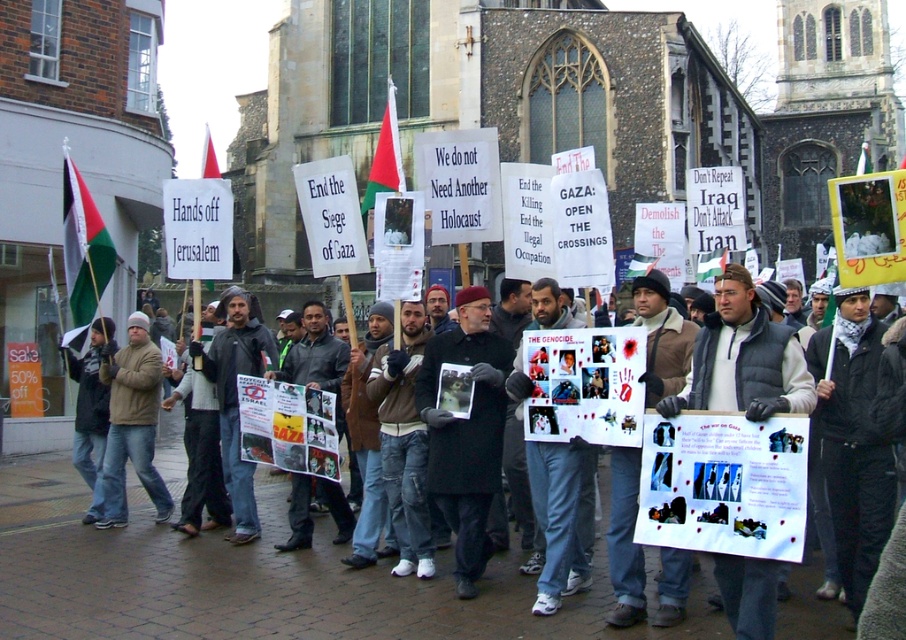
Between white paper poster at center and white fabric flag at center, which one has more height?

white fabric flag at center is taller.

Is point (747, 300) farther from camera compared to point (209, 131)?

No, (747, 300) is closer to viewer.

Between point (815, 394) and point (207, 128), which one is positioned in front?

Point (815, 394) is more forward.

Identify the location of white paper poster at center. (744, 358).

Does point (87, 202) lie behind point (403, 182)?

Yes, it is behind point (403, 182).

Is point (99, 282) in front of point (383, 168)?

No.

Between point (71, 289) and point (362, 221), which one is positioned in front?

Positioned in front is point (362, 221).

Find the location of `green-white-red-black fabric flag at left`. green-white-red-black fabric flag at left is located at coordinates (83, 244).

Does point (829, 627) lie in front of point (389, 186)?

Yes, point (829, 627) is in front of point (389, 186).

The width and height of the screenshot is (906, 640). I want to click on dark gray jacket at center, so click(x=286, y=589).